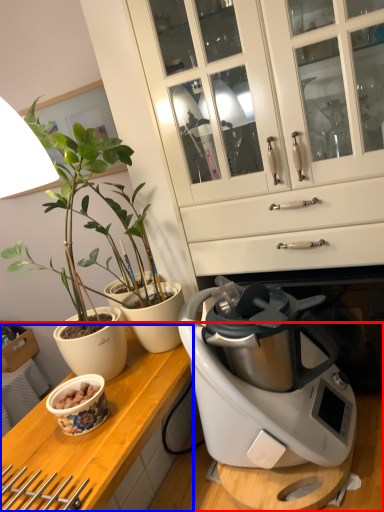
Question: Which object appears farthest to the camera in this image, countertop (highlighted by a red box) or counter top (highlighted by a blue box)?

Choices:
 (A) countertop
 (B) counter top

Answer: (B)